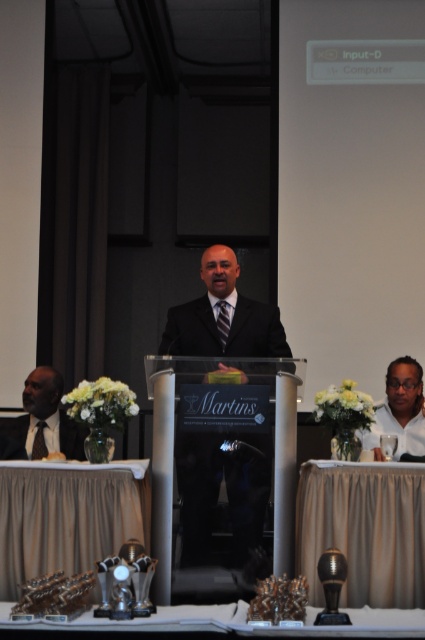
You are attending a formal event and need to locate the speaker. Based on the scene description, which object is positioned higher up, the matte black suit at center or the matte black suit at left?

The matte black suit at center is located above the matte black suit at left.

What is the color of the suit worn by the person standing at the point with coordinates (x=218, y=492) in the image?

The point at coordinates (x=218, y=492) is on a matte black suit at center, so the color of the suit is matte black.

You are organizing a photo shoot and need to arrange the matte black suit at center and the matte black suit at left in a way that maintains their size relationship. If you want to place them side by side on a table, which one should be placed closer to the camera to ensure the size difference is accurately represented?

The matte black suit at center is smaller than the matte black suit at left. To maintain the size relationship, the smaller matte black suit at center should be placed closer to the camera so it appears the same size as the larger matte black suit at left when viewed from the camera position.